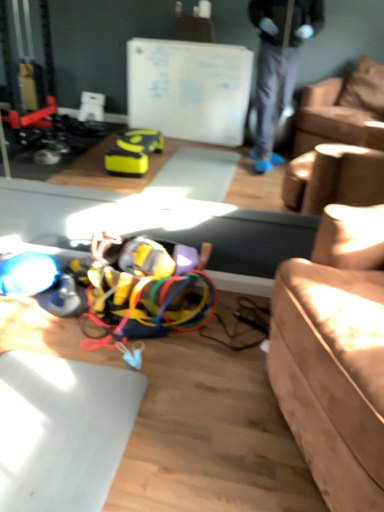
The width and height of the screenshot is (384, 512). Identify the location of leather couch at right. (334, 358).

Measure the distance between leather couch at right and camera.

91.74 centimeters.

This screenshot has height=512, width=384. What do you see at coordinates (334, 358) in the screenshot? I see `leather couch at right` at bounding box center [334, 358].

I want to click on multicolored plastic wires at center, so click(x=146, y=304).

Measure the distance between point (x=96, y=285) and camera.

Point (x=96, y=285) is 1.99 meters from camera.

This screenshot has width=384, height=512. What do you see at coordinates (146, 304) in the screenshot?
I see `multicolored plastic wires at center` at bounding box center [146, 304].

Locate an element on the screen. leather couch at right is located at coordinates (334, 358).

Is leather couch at right at the right side of multicolored plastic wires at center?

Indeed, leather couch at right is positioned on the right side of multicolored plastic wires at center.

Which object is closer to the camera, leather couch at right or multicolored plastic wires at center?

leather couch at right.

Which is nearer, [326,273] or [107,276]?

Point [326,273] is closer to the camera than point [107,276].

From the image's perspective, between leather couch at right and multicolored plastic wires at center, who is located below?

leather couch at right, from the image's perspective.

From a real-world perspective, is leather couch at right located higher than multicolored plastic wires at center?

Yes, from a real-world perspective, leather couch at right is on top of multicolored plastic wires at center.

Can you confirm if leather couch at right is wider than multicolored plastic wires at center?

Indeed, leather couch at right has a greater width compared to multicolored plastic wires at center.

Considering the sizes of objects leather couch at right and multicolored plastic wires at center in the image provided, who is shorter, leather couch at right or multicolored plastic wires at center?

Standing shorter between the two is multicolored plastic wires at center.

Can you confirm if leather couch at right is smaller than multicolored plastic wires at center?

No, leather couch at right is not smaller than multicolored plastic wires at center.

Is leather couch at right not within multicolored plastic wires at center?

Yes, leather couch at right is located beyond the bounds of multicolored plastic wires at center.

Are leather couch at right and multicolored plastic wires at center located far from each other?

Actually, leather couch at right and multicolored plastic wires at center are a little close together.

Is leather couch at right facing towards multicolored plastic wires at center?

No, leather couch at right is not aimed at multicolored plastic wires at center.

How many degrees apart are the facing directions of leather couch at right and multicolored plastic wires at center?

They differ by 69.1 degrees in their facing directions.

At what (x,y) coordinates should I click in order to perform the action: click on studio couch below the multicolored plastic wires at center (from the image's perspective). Please return your answer as a coordinate pair (x, y). The image size is (384, 512). Looking at the image, I should click on pos(334,358).

Considering the relative positions of multicolored plastic wires at center and leather couch at right in the image provided, is multicolored plastic wires at center to the left of leather couch at right from the viewer's perspective?

Correct, you'll find multicolored plastic wires at center to the left of leather couch at right.

Considering the positions of objects multicolored plastic wires at center and leather couch at right in the image provided, who is in front, multicolored plastic wires at center or leather couch at right?

leather couch at right is in front.

Considering the positions of point (115, 274) and point (296, 405), is point (115, 274) closer or farther from the camera than point (296, 405)?

Point (115, 274).

From the image's perspective, which one is positioned lower, multicolored plastic wires at center or leather couch at right?

leather couch at right, from the image's perspective.

From a real-world perspective, which object rests below the other?

multicolored plastic wires at center is physically lower.

Can you confirm if multicolored plastic wires at center is wider than leather couch at right?

No, multicolored plastic wires at center is not wider than leather couch at right.

Considering the sizes of objects multicolored plastic wires at center and leather couch at right in the image provided, who is taller, multicolored plastic wires at center or leather couch at right?

Standing taller between the two is leather couch at right.

Is multicolored plastic wires at center smaller than leather couch at right?

Indeed, multicolored plastic wires at center has a smaller size compared to leather couch at right.

Choose the correct answer: Is multicolored plastic wires at center inside leather couch at right or outside it?

multicolored plastic wires at center exists outside the volume of leather couch at right.

Are multicolored plastic wires at center and leather couch at right making contact?

multicolored plastic wires at center is not next to leather couch at right, and they're not touching.

Does multicolored plastic wires at center turn towards leather couch at right?

No.

What's the angular difference between multicolored plastic wires at center and leather couch at right's facing directions?

69.1 degrees separate the facing orientations of multicolored plastic wires at center and leather couch at right.

Measure the distance between multicolored plastic wires at center and leather couch at right.

multicolored plastic wires at center is 68.42 centimeters from leather couch at right.

Identify the location of studio couch that is on the right side of multicolored plastic wires at center. click(x=334, y=358).

The width and height of the screenshot is (384, 512). I want to click on wire on the left of leather couch at right, so click(x=146, y=304).

The width and height of the screenshot is (384, 512). In order to click on wire behind the leather couch at right in this screenshot , I will do `click(146, 304)`.